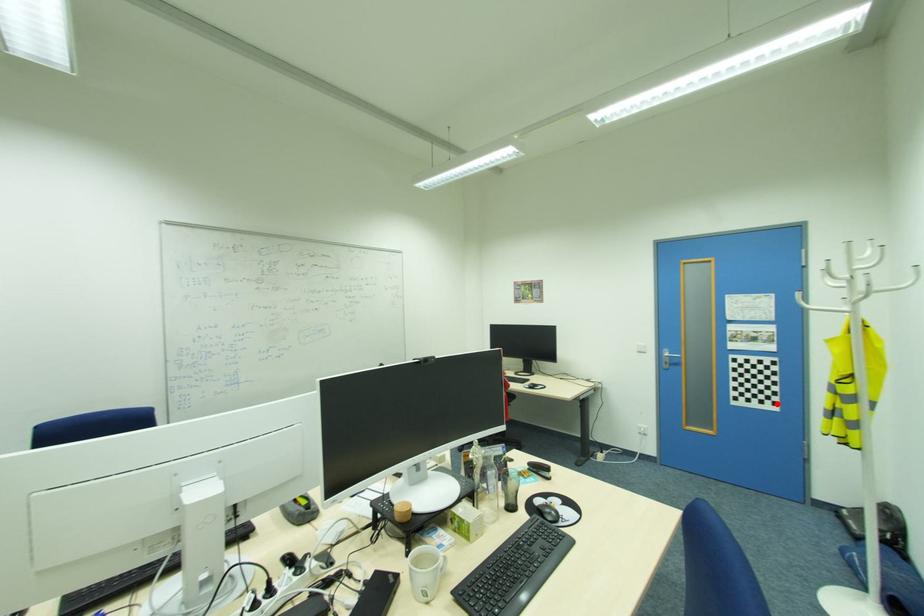
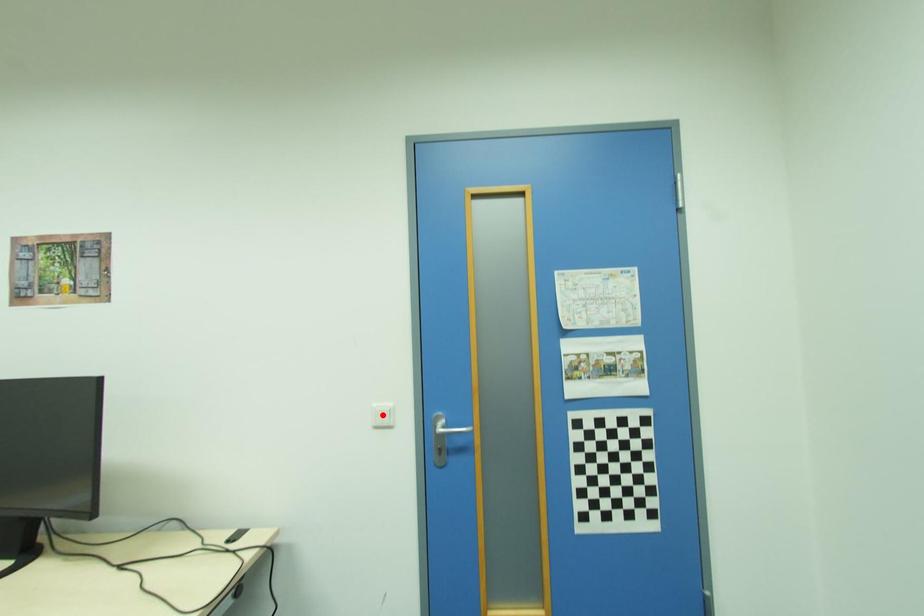
I am providing you with two images of the same scene from different viewpoints. A red point is marked on the first image and another point is marked on the second image. Does the point marked in image1 correspond to the same location as the one in image2?

No